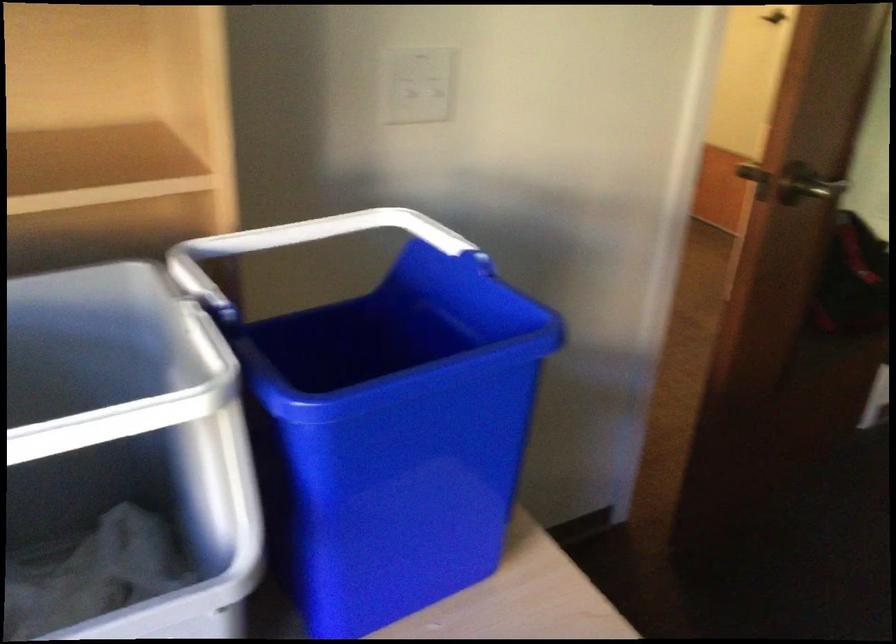
Find where to lift the grey bin rim. Please return your answer as a coordinate pair (x, y).

(59, 591)